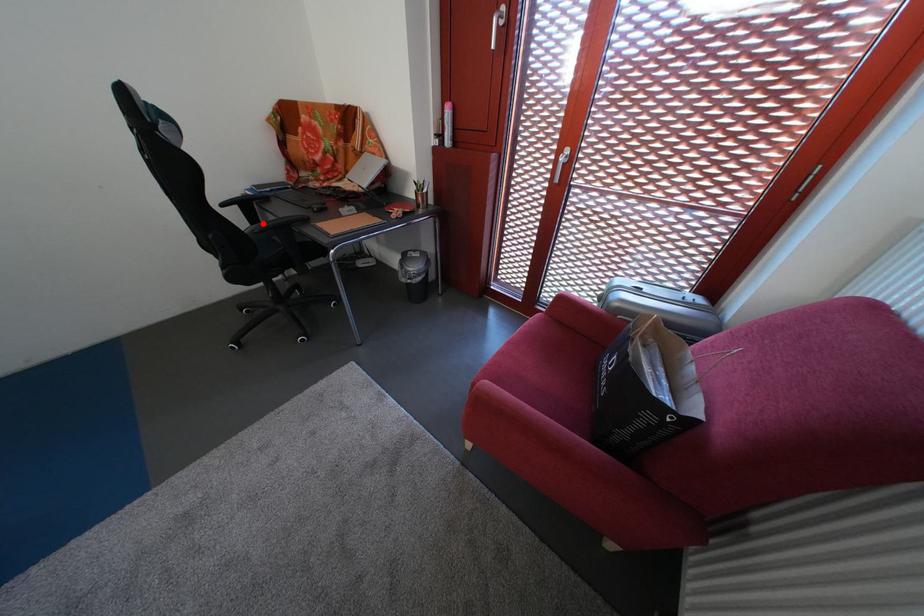
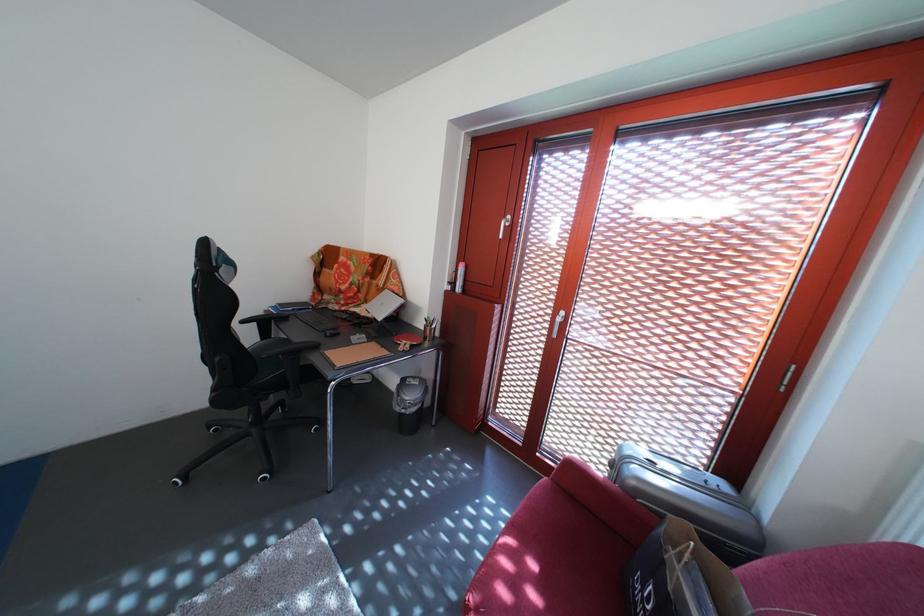
In the second image, find the point that corresponds to the highlighted location in the first image.

(275, 339)